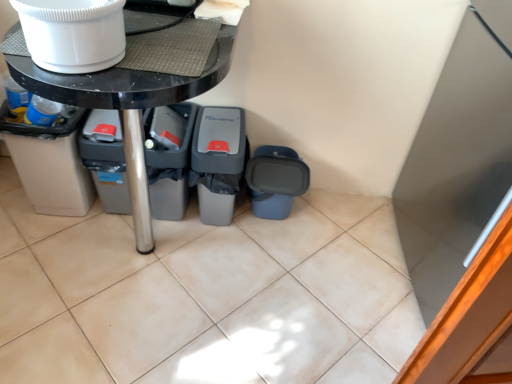
Find the location of a particular element. The height and width of the screenshot is (384, 512). vacant space that's between black glossy table at center and beige plastic recycling bin at lower left, placed as the first recycling bin when sorted from left to right is located at coordinates (49, 245).